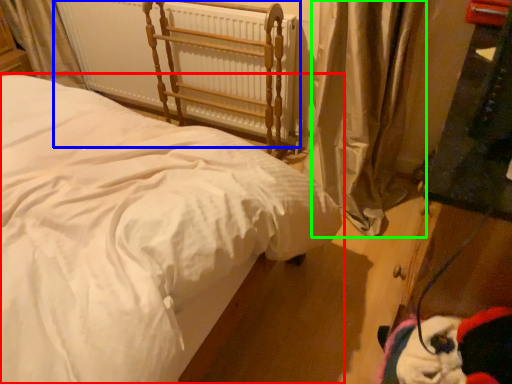
Question: Which is farther away from bed (highlighted by a red box)? radiator (highlighted by a blue box) or curtain (highlighted by a green box)?

Choices:
 (A) radiator
 (B) curtain

Answer: (A)